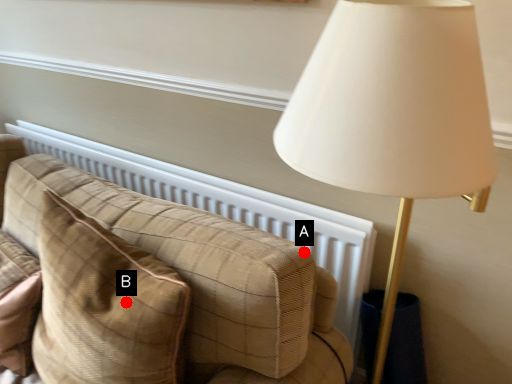
Question: Two points are circled on the image, labeled by A and B beside each circle. Which point is closer to the camera?

Choices:
 (A) A is closer
 (B) B is closer

Answer: (B)